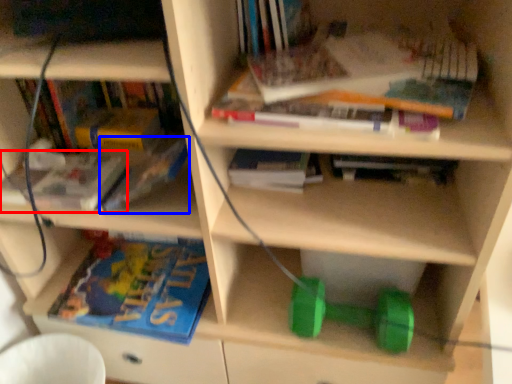
Question: Which object is further to the camera taking this photo, book (highlighted by a red box) or book (highlighted by a blue box)?

Choices:
 (A) book
 (B) book

Answer: (A)